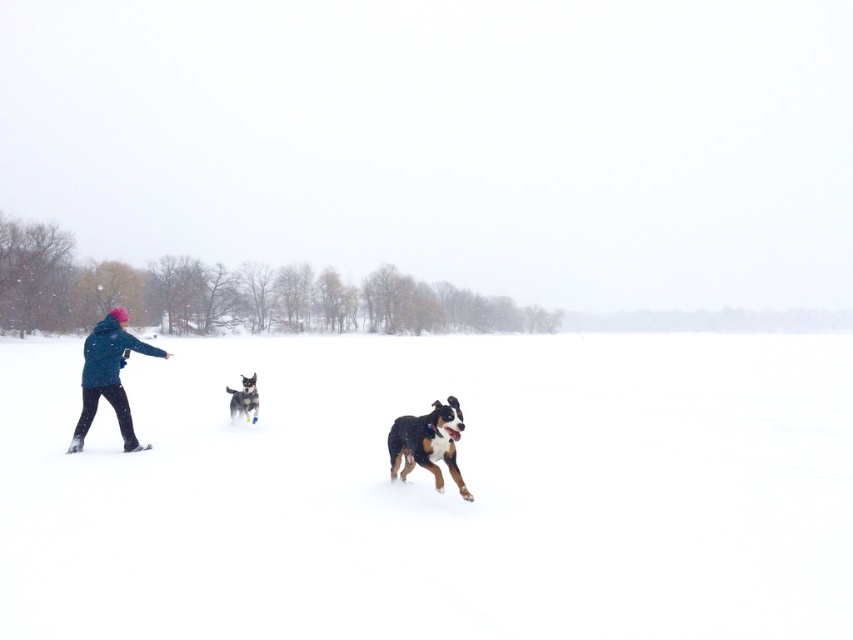
Who is taller, white fluffy snow at center or blue fleece jacket at left?

With more height is white fluffy snow at center.

Can you confirm if white fluffy snow at center is bigger than blue fleece jacket at left?

Indeed, white fluffy snow at center has a larger size compared to blue fleece jacket at left.

Does point (759, 413) come farther from viewer compared to point (94, 340)?

Yes, it is.

Locate an element on the screen. white fluffy snow at center is located at coordinates (434, 492).

Does blue fleece jacket at left appear over brown and white fur dog at center?

No, blue fleece jacket at left is not above brown and white fur dog at center.

Does blue fleece jacket at left have a lesser width compared to brown and white fur dog at center?

Yes.

Who is more distant from viewer, (x=91, y=417) or (x=437, y=465)?

Positioned behind is point (x=91, y=417).

Find the location of a particular element. blue fleece jacket at left is located at coordinates (108, 376).

Can you confirm if brown and white fur dog at center is positioned to the left of black fur dog at center?

No, brown and white fur dog at center is not to the left of black fur dog at center.

Does brown and white fur dog at center lie in front of black fur dog at center?

Yes, brown and white fur dog at center is in front of black fur dog at center.

The image size is (853, 640). What do you see at coordinates (428, 444) in the screenshot?
I see `brown and white fur dog at center` at bounding box center [428, 444].

Identify the location of brown and white fur dog at center. Image resolution: width=853 pixels, height=640 pixels. (428, 444).